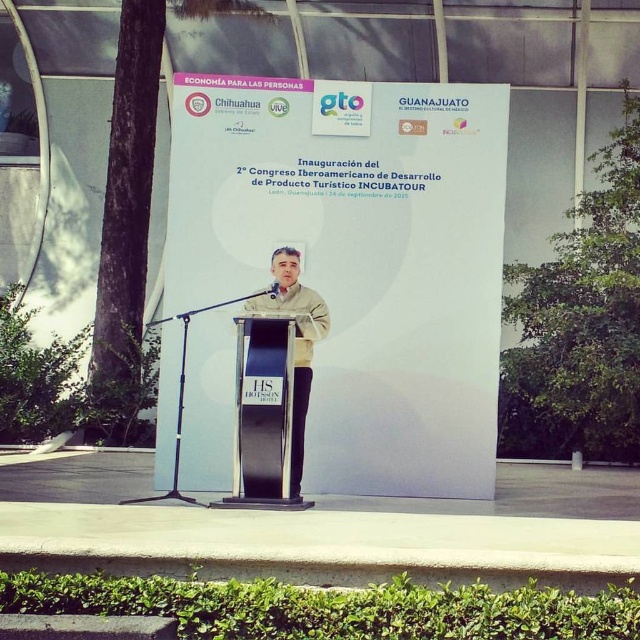
You are an event organizer who needs to place a 1.2 meter wide promotional banner on the stage. The banner must be placed to the left of the black polished wood podium at center but still within the stage area. Considering the light beige fabric shirt at center is worn by the speaker standing at the podium, will the space to the left of the podium be sufficient for the banner without overlapping the speaker?

The black polished wood podium at center is wider than the light beige fabric shirt at center. Since the podium is 1.2 meters wide, the space to its left should accommodate the banner without overlapping the speaker.

You are a photographer positioned at the back of the event hall. You want to take a photo of the speaker so that both the black polished wood podium at center and the light beige fabric shirt at center are clearly visible. Considering their positions, which object should you focus on first to ensure both are in focus?

You should focus on the black polished wood podium at center first because it is closer to the viewer than the light beige fabric shirt at center. By focusing on the closer object, the depth of field may allow both to be in focus.

You are attending the event and want to take a photo of the podium and the banner. You have two points marked on your camera screen to focus on. The first point is at coordinates point (280, 477) and the second is at point (323, 301). Which point should you focus on to ensure the podium is in focus?

You should focus on point (280, 477) because it is closer to the viewer than point (323, 301), so focusing there will ensure the podium is in focus.